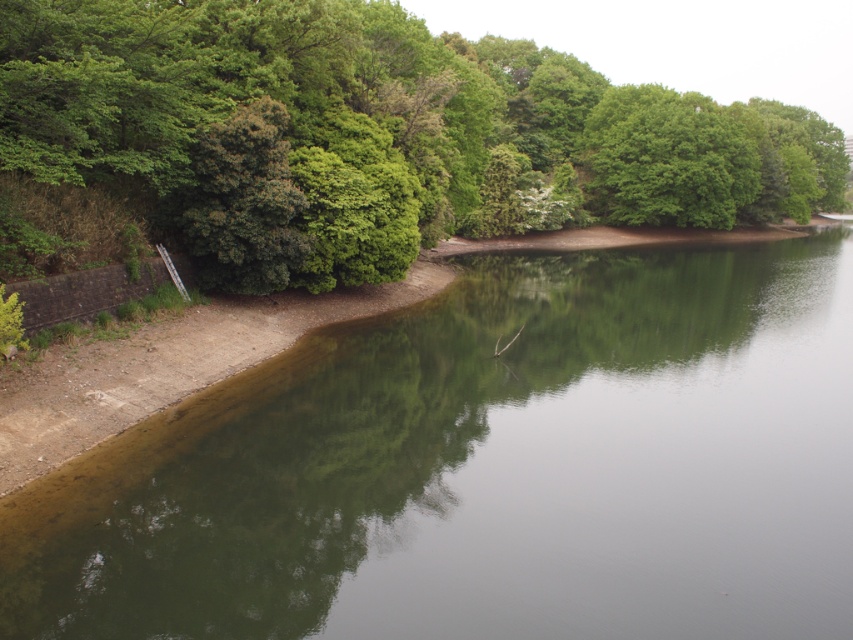
You are standing at the edge of the lake and see two points marked on the water surface. The first point is at coordinates point (x=432, y=552) and the second is at point (x=376, y=296). Which point is closer to you?

Point (x=432, y=552) is in front of point (x=376, y=296), so it is closer to you.

You are standing at the edge of the lake and want to take a photo of the green reflective water at center and the dull concrete shoreline at lower left. Which object will appear larger in your photo?

The green reflective water at center will appear larger in the photo because it is closer to the viewer than the dull concrete shoreline at lower left.

You are standing at the lakeside and want to determine the relative positions of two points marked in the scene. Which point, point (276, 307) or point (659, 180), is closer to you?

Point (276, 307) is closer to the viewer than point (659, 180).